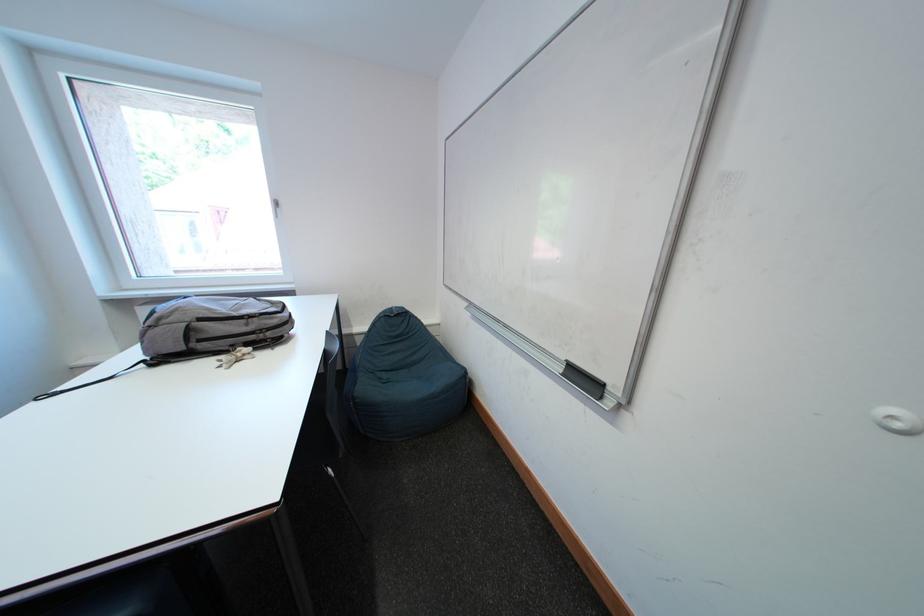
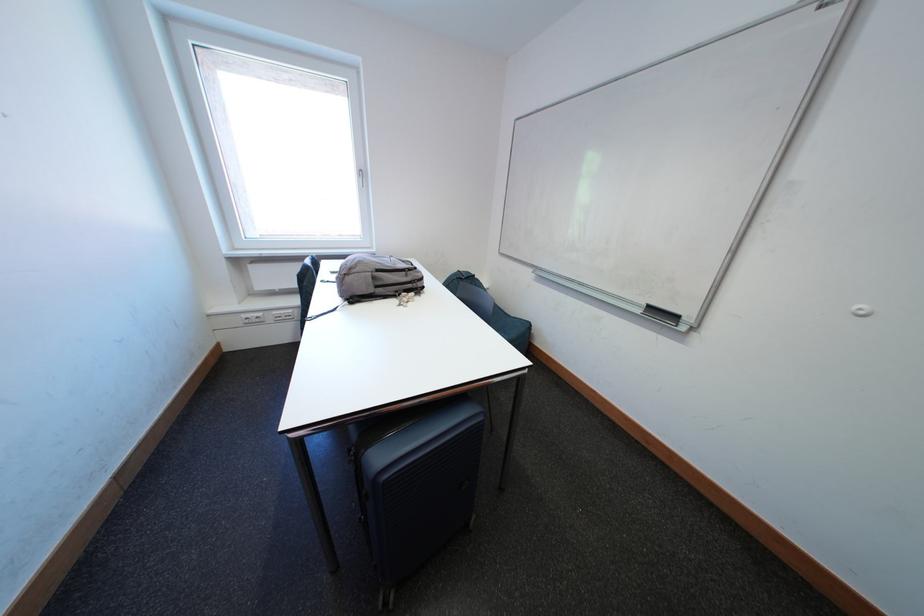
Locate, in the second image, the point that corresponds to pixel 241 349 in the first image.

(406, 294)